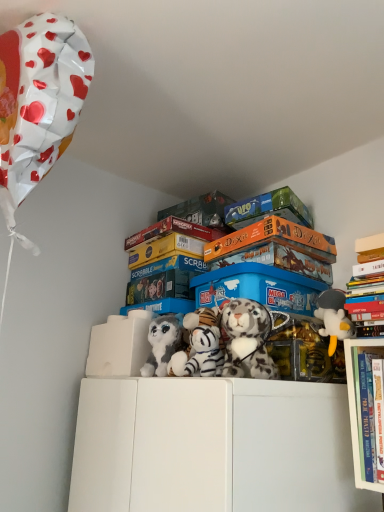
Question: Which direction should I rotate to look at white plush tiger at center, the second toy positioned from the right?

Choices:
 (A) left
 (B) right

Answer: (B)

Question: Considering the relative sizes of blue plastic storage box at center and fluffy gray plush at center, which is counted as the 1th toy, starting from the left, in the image provided, is blue plastic storage box at center wider than fluffy gray plush at center, which is counted as the 1th toy, starting from the left,?

Choices:
 (A) yes
 (B) no

Answer: (A)

Question: Does blue plastic storage box at center contain fluffy gray plush at center, which is counted as the 1th toy, starting from the left?

Choices:
 (A) no
 (B) yes

Answer: (A)

Question: Is blue plastic storage box at center taller than fluffy gray plush at center, which is counted as the 1th toy, starting from the left?

Choices:
 (A) no
 (B) yes

Answer: (A)

Question: Is the depth of blue plastic storage box at center greater than that of fluffy gray plush at center, the fourth toy when ordered from right to left?

Choices:
 (A) yes
 (B) no

Answer: (A)

Question: Considering the relative positions of blue plastic storage box at center and fluffy gray plush at center, the fourth toy when ordered from right to left, in the image provided, is blue plastic storage box at center to the left of fluffy gray plush at center, the fourth toy when ordered from right to left, from the viewer's perspective?

Choices:
 (A) yes
 (B) no

Answer: (B)

Question: Could you tell me if blue plastic storage box at center is turned towards fluffy gray plush at center, the fourth toy when ordered from right to left?

Choices:
 (A) yes
 (B) no

Answer: (B)

Question: From the image's perspective, is white plush tiger at center, the second toy viewed from the left, above hardcover books at upper right?

Choices:
 (A) yes
 (B) no

Answer: (A)

Question: Is white plush tiger at center, the third toy in the right-to-left sequence, oriented towards hardcover books at upper right?

Choices:
 (A) no
 (B) yes

Answer: (A)

Question: From a real-world perspective, is white plush tiger at center, the third toy in the right-to-left sequence, on hardcover books at upper right?

Choices:
 (A) yes
 (B) no

Answer: (A)

Question: Is white plush tiger at center, the third toy in the right-to-left sequence, bigger than hardcover books at upper right?

Choices:
 (A) no
 (B) yes

Answer: (A)

Question: Considering the relative sizes of white plush tiger at center, the third toy in the right-to-left sequence, and hardcover books at upper right in the image provided, is white plush tiger at center, the third toy in the right-to-left sequence, shorter than hardcover books at upper right?

Choices:
 (A) yes
 (B) no

Answer: (A)

Question: Does white plush tiger at center, the second toy viewed from the left, appear on the right side of hardcover books at upper right?

Choices:
 (A) no
 (B) yes

Answer: (A)

Question: Are blue plastic storage box at center and hardcover books at upper right beside each other?

Choices:
 (A) yes
 (B) no

Answer: (B)